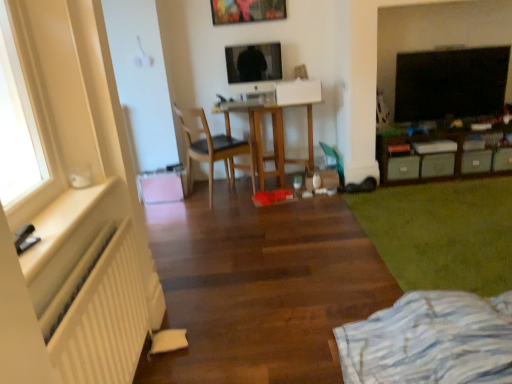
At what (x,y) coordinates should I click in order to perform the action: click on green matte drawer at lower right, the first drawer positioned from the right. Please return your answer as a coordinate pair (x, y). The image size is (512, 384). Looking at the image, I should click on (502, 159).

This screenshot has height=384, width=512. Describe the element at coordinates (208, 146) in the screenshot. I see `light brown wooden chair at center` at that location.

At what (x,y) coordinates should I click in order to perform the action: click on light brown wooden chair at center. Please return your answer as a coordinate pair (x, y). The image size is (512, 384). Looking at the image, I should click on (208, 146).

In order to click on gray matte drawer at lower right, which is counted as the third drawer, starting from the right in this screenshot , I will do `click(437, 165)`.

Locate an element on the screen. Image resolution: width=512 pixels, height=384 pixels. white matte radiator at left is located at coordinates (76, 135).

Identify the location of white wooden window sill at left. This screenshot has width=512, height=384. (60, 224).

Where is `green matte drawer at lower right, the first drawer positioned from the right`? green matte drawer at lower right, the first drawer positioned from the right is located at coordinates (502, 159).

Is point (500, 152) in front of point (377, 135)?

Yes.

Which is more to the left, green matte drawer at lower right, the first drawer positioned from the right, or green matte storage unit at right?

green matte storage unit at right.

Where is `table in front of the green matte drawer at lower right, the first drawer positioned from the right`? table in front of the green matte drawer at lower right, the first drawer positioned from the right is located at coordinates (444, 154).

Looking at this image, is green matte drawer at lower right, the first drawer positioned from the right, turned away from green matte storage unit at right?

Yes, green matte drawer at lower right, the first drawer positioned from the right, is positioned with its back facing green matte storage unit at right.

Which of these two, white matte radiator at left or wooden desk at center, is wider?

Wider between the two is wooden desk at center.

Which is closer to the camera, (23, 336) or (245, 111)?

Positioned in front is point (23, 336).

Consider the image. From a real-world perspective, is white matte radiator at left located higher than wooden desk at center?

Yes, from a real-world perspective, white matte radiator at left is above wooden desk at center.

How different are the orientations of white matte radiator at left and wooden desk at center in degrees?

The angle between the facing direction of white matte radiator at left and the facing direction of wooden desk at center is 88.7 degrees.

Considering the positions of point (61, 92) and point (393, 165), is point (61, 92) closer or farther from the camera than point (393, 165)?

Point (61, 92) is closer to the camera than point (393, 165).

Can you confirm if white matte radiator at left is smaller than green matte drawer at right, which is counted as the 1th drawer, starting from the left?

Incorrect, white matte radiator at left is not smaller in size than green matte drawer at right, which is counted as the 1th drawer, starting from the left.

Is white matte radiator at left looking in the opposite direction of green matte drawer at right, which is the 4th drawer from right to left?

No, white matte radiator at left is not facing away from green matte drawer at right, which is the 4th drawer from right to left.

Which is more to the right, white matte radiator at left or green matte drawer at right, which is counted as the 1th drawer, starting from the left?

green matte drawer at right, which is counted as the 1th drawer, starting from the left, is more to the right.

From a real-world perspective, is green matte drawer at lower right, the first drawer positioned from the right, on green plush carpet at lower right?

Yes, from a real-world perspective, green matte drawer at lower right, the first drawer positioned from the right, is over green plush carpet at lower right

From the image's perspective, is green matte drawer at lower right, the fourth drawer positioned from the left, above or below green plush carpet at lower right?

From the image's perspective, green matte drawer at lower right, the fourth drawer positioned from the left, appears above green plush carpet at lower right.

Is green matte drawer at lower right, the fourth drawer positioned from the left, turned away from green plush carpet at lower right?

That's not correct — green matte drawer at lower right, the fourth drawer positioned from the left, is not looking away from green plush carpet at lower right.

Is point (479, 154) closer to viewer compared to point (503, 160)?

That is True.

Is green matte drawer at right, which ranks as the 3th drawer in left-to-right order, facing towards green matte drawer at lower right, the first drawer positioned from the right?

No, green matte drawer at right, which ranks as the 3th drawer in left-to-right order, is not oriented towards green matte drawer at lower right, the first drawer positioned from the right.

From the image's perspective, would you say white matte radiator at lower left is positioned over light brown wooden chair at center?

Incorrect, from the image's perspective, white matte radiator at lower left is lower than light brown wooden chair at center.

Is white matte radiator at lower left looking in the opposite direction of light brown wooden chair at center?

No, light brown wooden chair at center is not at the back of white matte radiator at lower left.

The height and width of the screenshot is (384, 512). I want to click on chair to the right of white matte radiator at lower left, so click(x=208, y=146).

Is white matte radiator at lower left located outside light brown wooden chair at center?

Yes, white matte radiator at lower left is not within light brown wooden chair at center.

Is white matte radiator at left not within white matte radiator at lower left?

Yes, white matte radiator at left is not within white matte radiator at lower left.

Considering the sizes of objects white matte radiator at left and white matte radiator at lower left in the image provided, who is bigger, white matte radiator at left or white matte radiator at lower left?

Bigger between the two is white matte radiator at left.

Is white matte radiator at left beside white matte radiator at lower left?

No, white matte radiator at left is not with white matte radiator at lower left.

Which object is wider, white matte radiator at left or white matte radiator at lower left?

white matte radiator at left.

The width and height of the screenshot is (512, 384). What are the coordinates of `table on the left side of green matte drawer at lower right, the first drawer positioned from the right` in the screenshot? It's located at (444, 154).

Where is `desk that is above the white matte radiator at left (from the image's perspective)`? This screenshot has height=384, width=512. desk that is above the white matte radiator at left (from the image's perspective) is located at coordinates (273, 140).

Based on their spatial positions, is black glossy tv at upper right or white striped fabric at lower right closer to white matte radiator at left?

white striped fabric at lower right lies closer to white matte radiator at left than the other object.

Looking at the image, which one is located closer to green plush carpet at lower right, gray matte drawer at lower right, which ranks as the 2th drawer in left-to-right order, or light brown wooden chair at center?

The object closer to green plush carpet at lower right is gray matte drawer at lower right, which ranks as the 2th drawer in left-to-right order.

Based on their spatial positions, is green matte drawer at lower right, the first drawer positioned from the right, or white striped fabric at lower right closer to green plush carpet at lower right?

white striped fabric at lower right.

Estimate the real-world distances between objects in this image. Which object is closer to white matte radiator at left, gray matte drawer at lower right, which ranks as the 2th drawer in left-to-right order, or green matte drawer at right, which is counted as the 1th drawer, starting from the left?

green matte drawer at right, which is counted as the 1th drawer, starting from the left.

Based on their spatial positions, is white wooden window sill at left or green matte drawer at right, which is counted as the 1th drawer, starting from the left, further from green matte drawer at right, which appears as the 2th drawer when viewed from the right?

white wooden window sill at left is positioned further to the anchor green matte drawer at right, which appears as the 2th drawer when viewed from the right.

Based on their spatial positions, is light brown wooden chair at center or white matte radiator at lower left closer to green matte drawer at lower right, the first drawer positioned from the right?

Among the two, light brown wooden chair at center is located nearer to green matte drawer at lower right, the first drawer positioned from the right.

Based on their spatial positions, is light brown wooden chair at center or green matte drawer at lower right, the fourth drawer positioned from the left, closer to white matte radiator at lower left?

light brown wooden chair at center lies closer to white matte radiator at lower left than the other object.

In the scene shown: Which object lies nearer to the anchor point white matte radiator at left, white matte radiator at lower left or white wooden window sill at left?

Among the two, white wooden window sill at left is located nearer to white matte radiator at left.

I want to click on chair between white wooden window sill at left and green matte drawer at right, which ranks as the 3th drawer in left-to-right order, in the horizontal direction, so click(x=208, y=146).

Identify the location of table between white striped fabric at lower right and gray matte drawer at lower right, which is counted as the third drawer, starting from the right, from front to back. (444, 154).

In order to click on window sill between white matte radiator at left and green matte storage unit at right in the front-back direction in this screenshot , I will do `click(60, 224)`.

Where is `bed between white matte radiator at left and green matte drawer at right, which appears as the 2th drawer when viewed from the right, from front to back`? The width and height of the screenshot is (512, 384). bed between white matte radiator at left and green matte drawer at right, which appears as the 2th drawer when viewed from the right, from front to back is located at coordinates (430, 341).